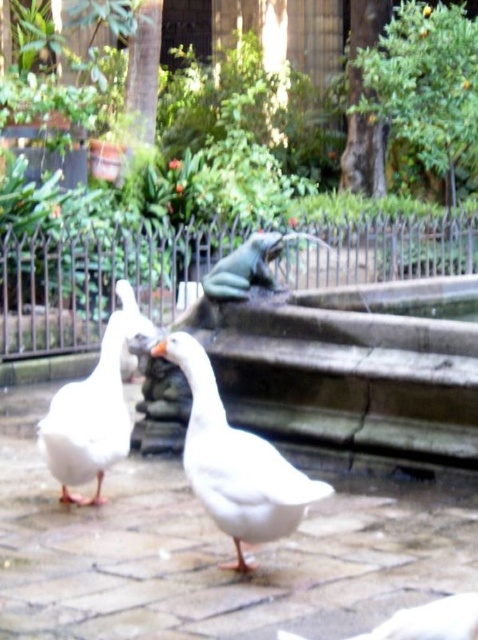
Is metallic wire fence at center positioned behind white matte duck at lower center?

Yes, metallic wire fence at center is behind white matte duck at lower center.

Is metallic wire fence at center closer to camera compared to white matte duck at lower center?

No, it is behind white matte duck at lower center.

Where is `metallic wire fence at center`? This screenshot has width=478, height=640. metallic wire fence at center is located at coordinates (97, 282).

Identify the location of metallic wire fence at center. The width and height of the screenshot is (478, 640). (97, 282).

Locate an element on the screen. The width and height of the screenshot is (478, 640). white matte duck at lower center is located at coordinates (431, 620).

What do you see at coordinates (431, 620) in the screenshot?
I see `white matte duck at lower center` at bounding box center [431, 620].

Identify the location of white matte duck at lower center. (431, 620).

Consider the image. Does metallic wire fence at center come in front of green rubber frog at center?

No, metallic wire fence at center is behind green rubber frog at center.

Does point (195, 241) lie behind point (212, 292)?

Yes, point (195, 241) is farther from viewer.

Where is `metallic wire fence at center`? metallic wire fence at center is located at coordinates (97, 282).